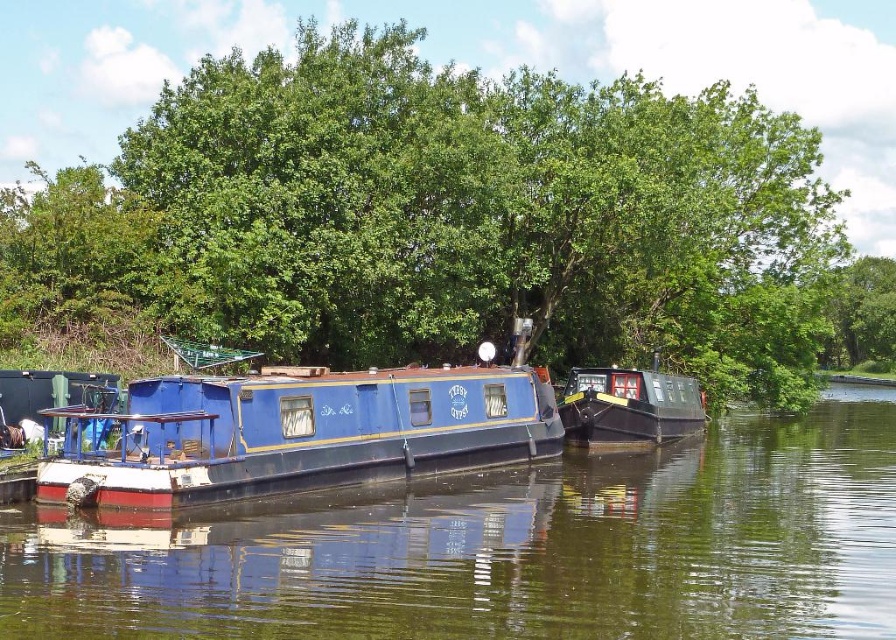
Can you confirm if blue glossy boat at center is positioned above matte black boat at center?

No, blue glossy boat at center is not above matte black boat at center.

Is blue glossy boat at center thinner than matte black boat at center?

No, blue glossy boat at center is not thinner than matte black boat at center.

This screenshot has width=896, height=640. In order to click on blue glossy boat at center in this screenshot , I will do `click(509, 548)`.

Where is `blue glossy boat at center`? Image resolution: width=896 pixels, height=640 pixels. blue glossy boat at center is located at coordinates (509, 548).

Does blue glossy boat at center appear over metallic blue boat at left?

Answer: No, blue glossy boat at center is not above metallic blue boat at left.

Is point (530, 490) positioned behind point (109, 372)?

No, it is not.

You are a GUI agent. You are given a task and a screenshot of the screen. Output one action in this format:
    pyautogui.click(x=<x>, y=<y>)
    Task: Click on the blue glossy boat at center
    The height and width of the screenshot is (640, 896).
    Given the screenshot: What is the action you would take?
    pyautogui.click(x=509, y=548)

Is blue glossy boat at center shorter than blue polished wood boat at center?

Yes, blue glossy boat at center is shorter than blue polished wood boat at center.

Between blue glossy boat at center and blue polished wood boat at center, which one has more height?

blue polished wood boat at center is taller.

Is point (639, 588) positioned in front of point (332, 385)?

Yes.

Identify the location of blue glossy boat at center. Image resolution: width=896 pixels, height=640 pixels. pyautogui.click(x=509, y=548).